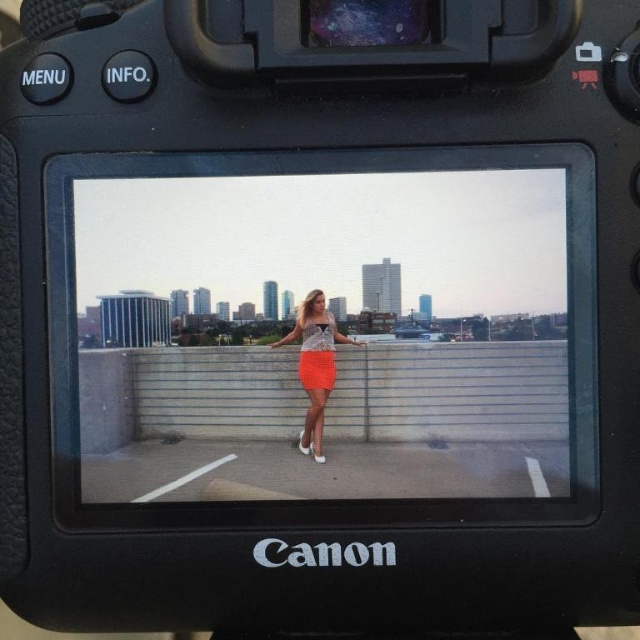
You are using a Canon DSLR camera and want to ensure that both the point at coordinates point (360, 342) and the point at coordinates point (316, 332) are in focus. Based on their positions in the scene, which point should you focus on first to ensure both are sharp?

Point (316, 332) should be focused on first because it is closer to the camera than point (360, 342), which is further away. By focusing on the closer point, the depth of field may extend to cover both points.

You are using a Canon DSLR camera to take a photo of a woman on a rooftop. The camera shows a point at coordinates point [300,364]. If the point is 36.81 inches from the camera, can you confirm if the woman is within the camera focus range?

The point at point [300,364] is 36.81 inches from the camera, so the woman is within the camera focus range as the distance is within typical DSLR focus range.